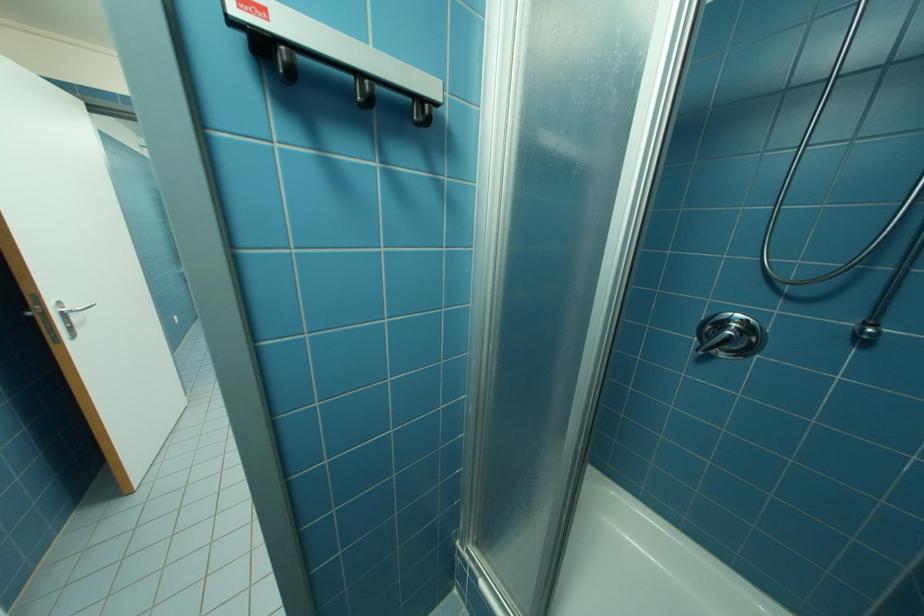
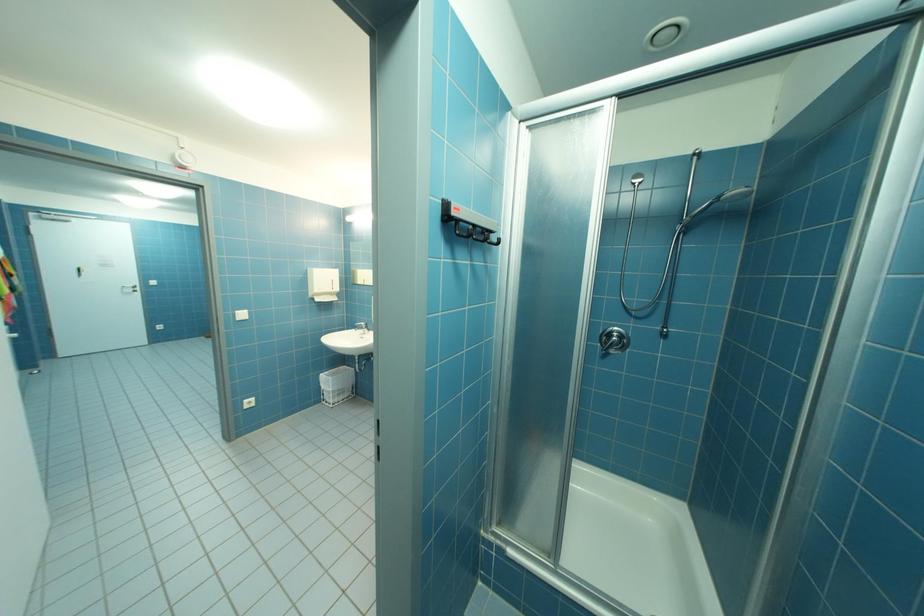
Question: The camera is either moving clockwise (left) or counter-clockwise (right) around the object. The first image is from the beginning of the video and the second image is from the end. Is the camera moving left or right when shooting the video?

Choices:
 (A) Left
 (B) Right

Answer: (A)